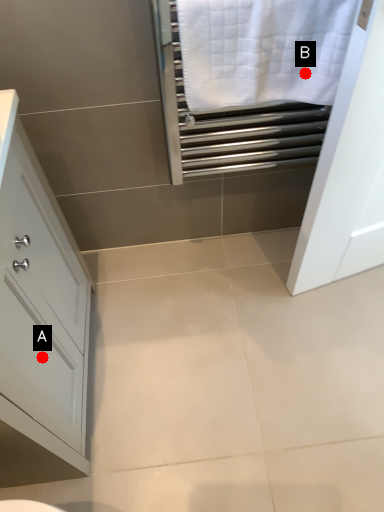
Question: Two points are circled on the image, labeled by A and B beside each circle. Which point appears farthest from the camera in this image?

Choices:
 (A) A is further
 (B) B is further

Answer: (B)